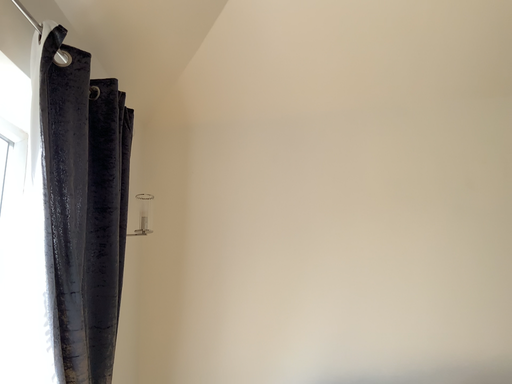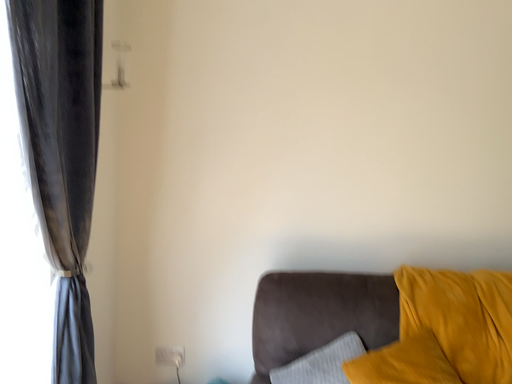
Question: Which way did the camera rotate in the video?

Choices:
 (A) rotated upward
 (B) rotated downward

Answer: (B)